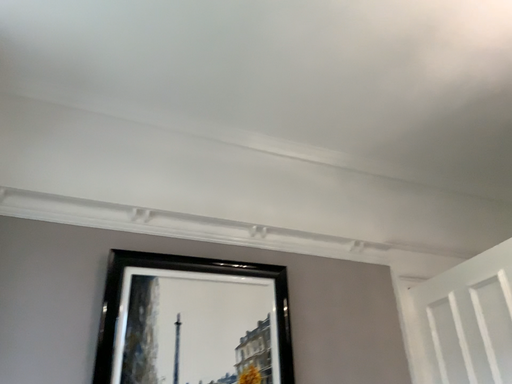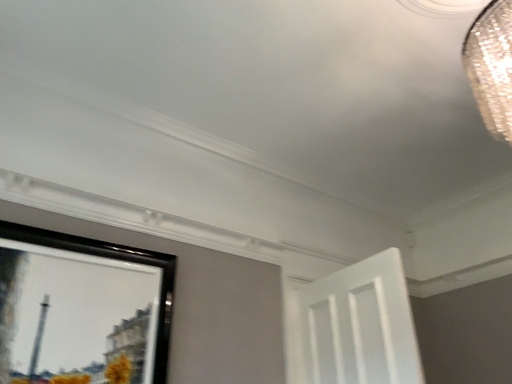
Question: Which way did the camera rotate in the video?

Choices:
 (A) rotated left
 (B) rotated right

Answer: (B)